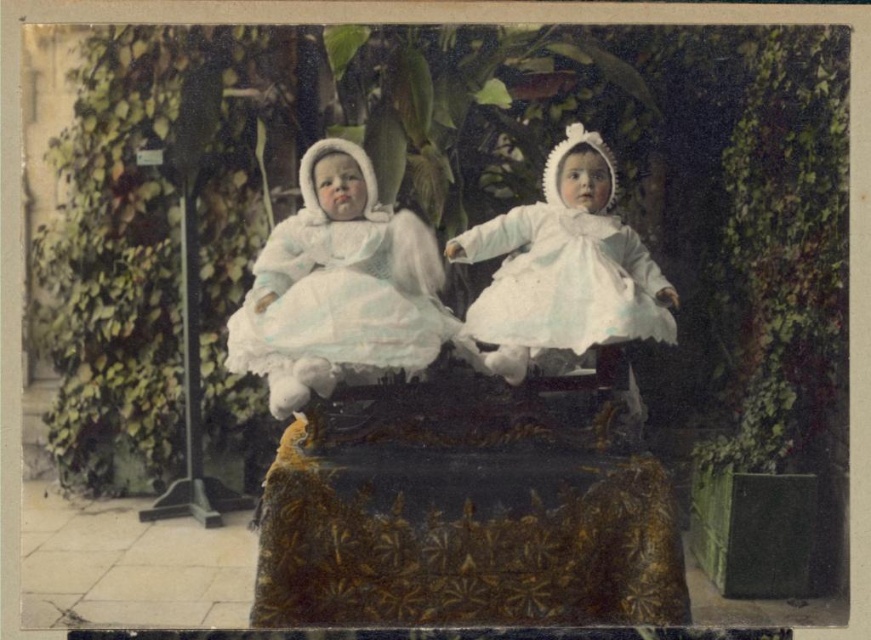
Looking at this image, you are a photographer trying to capture a closeup of both the white satin dress at center and the white lace dress at center. Since you can only focus on one at a time, which dress should you focus on first if you want to start from the left side?

The white satin dress at center is to the left of the white lace dress at center, so you should focus on the white satin dress at center first.

You are a photographer trying to decide which dress to focus on in the vintage photo. Both the white satin dress at center and the white lace dress at center are in the frame. Which dress has a narrower silhouette?

The white satin dress at center is thinner than the white lace dress at center, so the white satin dress at center has a narrower silhouette.

You are a photographer trying to capture both the white satin dress at center and the white lace dress at center in a single frame. Since the camera can only focus on one dress at a time, which dress should you focus on to ensure it appears larger in the photo?

The white satin dress at center has a greater height compared to the white lace dress at center, so focusing on it will ensure it appears larger in the photo.